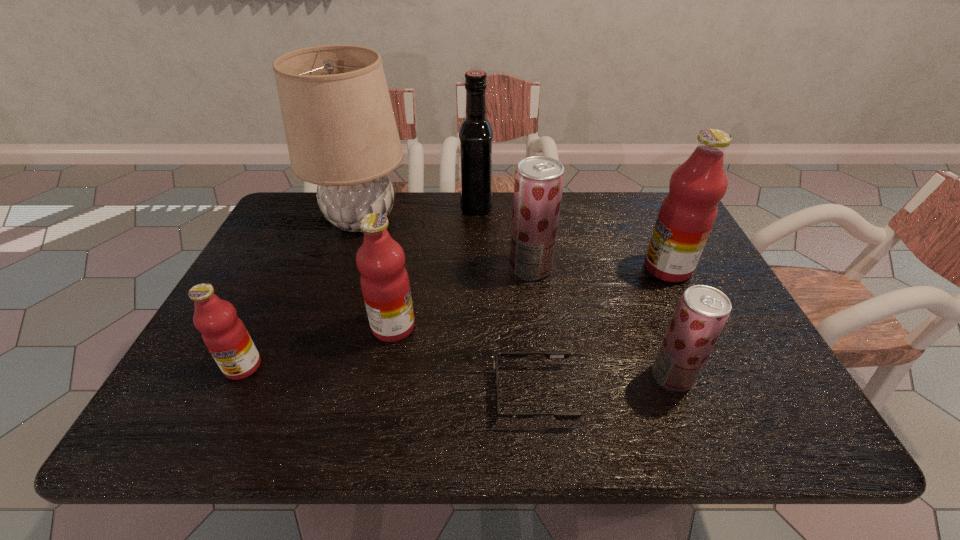
This screenshot has width=960, height=540. I want to click on free space between the second pink fruit juice from left to right and the smaller strawberry fruit juice, so click(x=533, y=352).

You are a GUI agent. You are given a task and a screenshot of the screen. Output one action in this format:
    pyautogui.click(x=<x>, y=<y>)
    Task: Click on the free spot between the nearest pink fruit juice and the liquor
    
    Given the screenshot: What is the action you would take?
    pyautogui.click(x=360, y=286)

The height and width of the screenshot is (540, 960). In order to click on free space between the bigger strawberry fruit juice and the lampshade in this screenshot , I will do `click(445, 244)`.

Where is `vacant area between the sunglasses and the leftmost fruit juice`? The width and height of the screenshot is (960, 540). vacant area between the sunglasses and the leftmost fruit juice is located at coordinates (388, 380).

Identify the location of free space between the bigger strawberry fruit juice and the fifth farthest object. [x=462, y=298].

Find the location of a particular element. Image resolution: width=960 pixels, height=540 pixels. vacant area that lies between the leftmost fruit juice and the right strawberry fruit juice is located at coordinates (458, 371).

Where is `vacant space that's between the second nearest pink fruit juice and the liquor`? vacant space that's between the second nearest pink fruit juice and the liquor is located at coordinates (435, 266).

Locate which object ranks in proximity to the right strawberry fruit juice. Please provide its 2D coordinates. Your answer should be formatted as a tuple, i.e. [(x, y)], where the tuple contains the x and y coordinates of a point satisfying the conditions above.

[(549, 355)]

Identify which object is the third nearest to the second nearest pink fruit juice. Please provide its 2D coordinates. Your answer should be formatted as a tuple, i.e. [(x, y)], where the tuple contains the x and y coordinates of a point satisfying the conditions above.

[(341, 133)]

Choose which fruit juice is the third nearest neighbor to the smallest pink fruit juice. Please provide its 2D coordinates. Your answer should be formatted as a tuple, i.e. [(x, y)], where the tuple contains the x and y coordinates of a point satisfying the conditions above.

[(702, 312)]